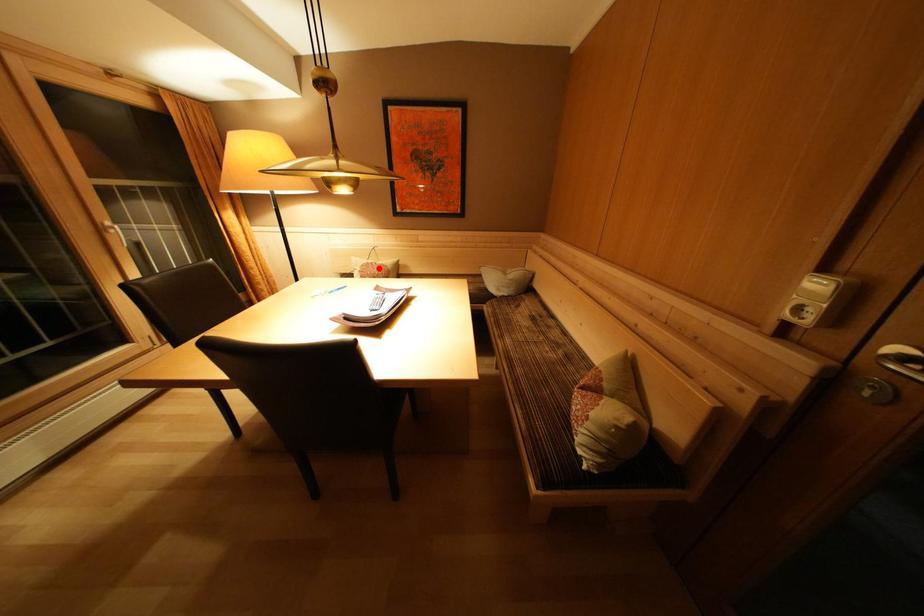
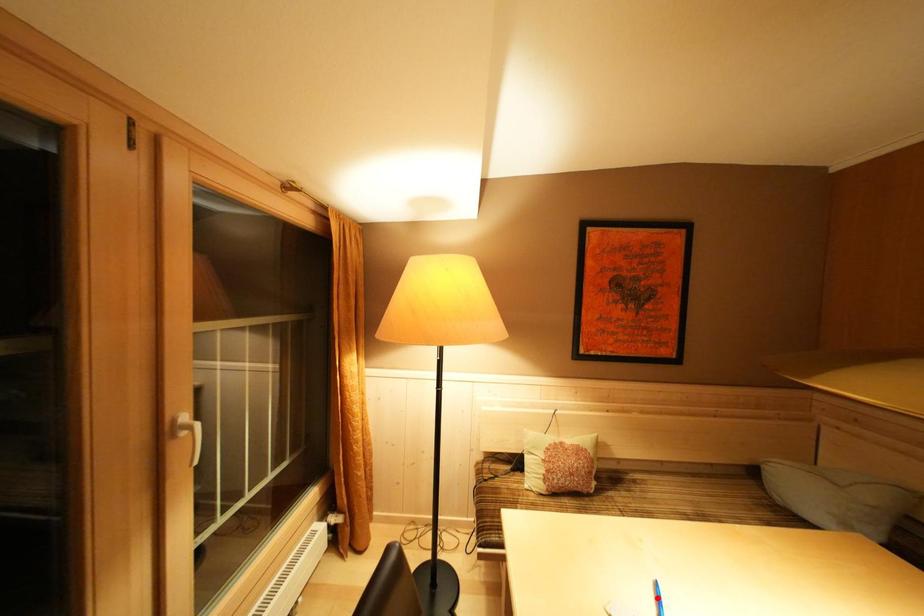
I am providing you with two images of the same scene from different viewpoints. A red point is marked on the first image and another point is marked on the second image. Do the highlighted points in image1 and image2 indicate the same real-world spot?

No